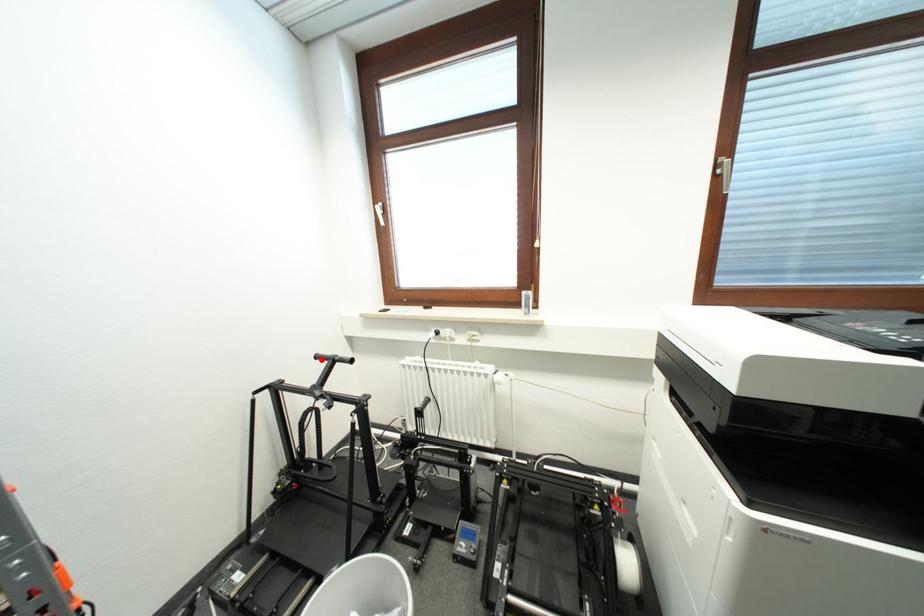
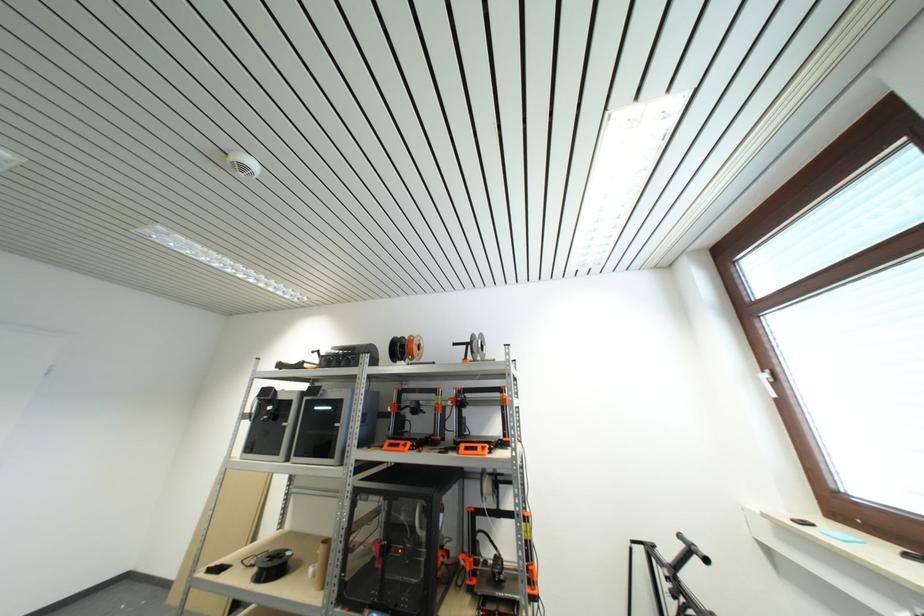
Locate, in the second image, the point that corresponds to the highlighted location in the first image.

(685, 540)